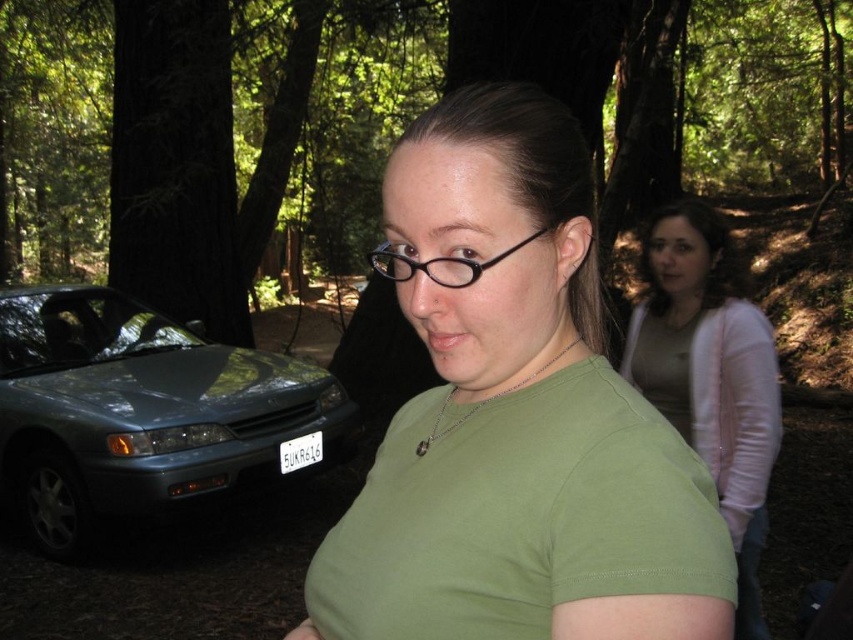
Question: Can you confirm if metallic blue car at left is wider than light pink sweater at upper right?

Choices:
 (A) yes
 (B) no

Answer: (A)

Question: Which point appears farthest from the camera in this image?

Choices:
 (A) (428, 276)
 (B) (459, 621)
 (C) (74, 296)
 (D) (766, 472)

Answer: (C)

Question: Can you confirm if metallic blue car at left is smaller than light pink sweater at upper right?

Choices:
 (A) yes
 (B) no

Answer: (B)

Question: Among these points, which one is nearest to the camera?

Choices:
 (A) (733, 472)
 (B) (258, 433)
 (C) (410, 273)
 (D) (473, 531)

Answer: (D)

Question: Which object appears closest to the camera in this image?

Choices:
 (A) light pink sweater at upper right
 (B) black plastic glasses at center

Answer: (B)

Question: Can you confirm if green matte shirt at center is positioned to the left of light pink sweater at upper right?

Choices:
 (A) no
 (B) yes

Answer: (B)